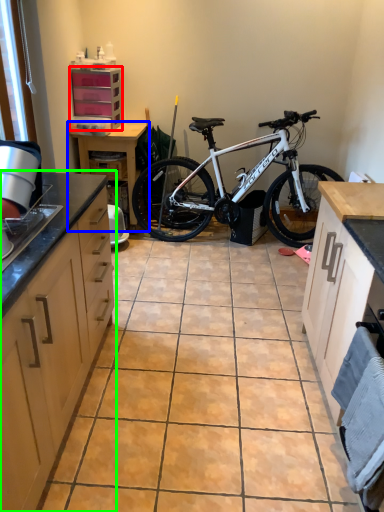
Question: Which object is positioned closest to cabinetry (highlighted by a red box)? Select from table (highlighted by a blue box) and cabinetry (highlighted by a green box).

Choices:
 (A) table
 (B) cabinetry

Answer: (A)